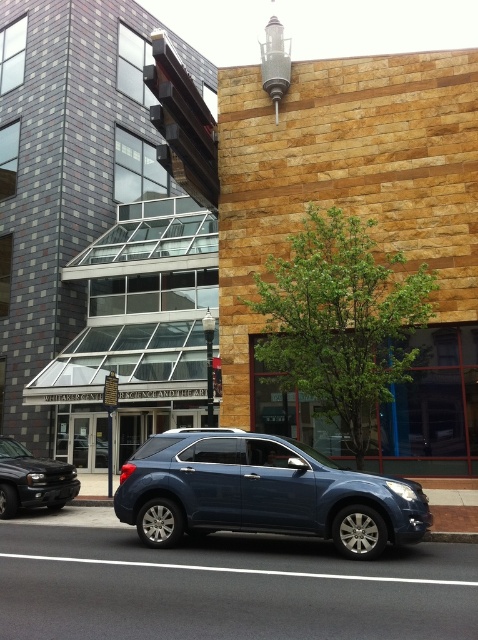
Can you confirm if shiny black suv at lower left is positioned above matte black suv at center?

Yes, shiny black suv at lower left is above matte black suv at center.

Who is more distant from viewer, (42, 506) or (86, 449)?

The point (86, 449) is behind.

Find the location of a particular element. shiny black suv at lower left is located at coordinates (32, 481).

At what (x,y) coordinates should I click in order to perform the action: click on shiny black suv at lower left. Please return your answer as a coordinate pair (x, y). The width and height of the screenshot is (478, 640). Looking at the image, I should click on (32, 481).

Is satin blue suv at center taller than shiny black suv at lower left?

Yes.

Consider the image. Does satin blue suv at center appear on the right side of shiny black suv at lower left?

Indeed, satin blue suv at center is positioned on the right side of shiny black suv at lower left.

Between point (198, 528) and point (55, 508), which one is positioned behind?

The point (55, 508) is behind.

The width and height of the screenshot is (478, 640). I want to click on satin blue suv at center, so click(262, 492).

Does point (178, 515) come closer to viewer compared to point (89, 465)?

Yes, point (178, 515) is closer to viewer.

How far apart are satin blue suv at center and matte black suv at center?

satin blue suv at center and matte black suv at center are 12.38 meters apart.

Does point (178, 484) come farther from viewer compared to point (74, 460)?

No.

Locate an element on the screen. This screenshot has height=640, width=478. satin blue suv at center is located at coordinates (262, 492).